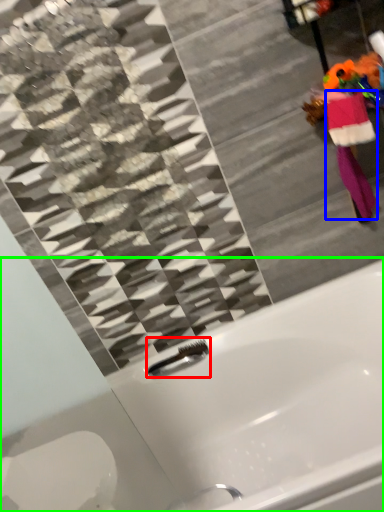
Question: Which object is the farthest from faucet (highlighted by a red box)? Choose among these: robe (highlighted by a blue box) or bathtub (highlighted by a green box).

Choices:
 (A) robe
 (B) bathtub

Answer: (A)